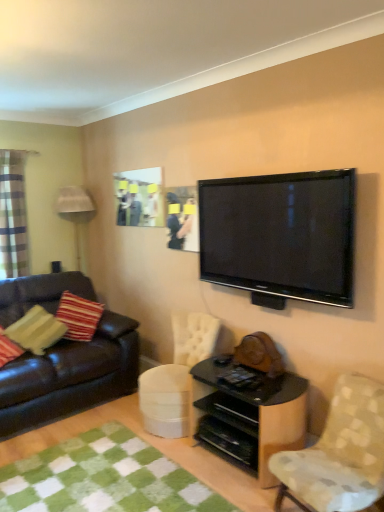
Question: Can you confirm if patterned fabric chair at lower right is positioned to the left of plaid fabric curtain at left?

Choices:
 (A) yes
 (B) no

Answer: (B)

Question: Considering the relative sizes of patterned fabric chair at lower right and plaid fabric curtain at left in the image provided, is patterned fabric chair at lower right shorter than plaid fabric curtain at left?

Choices:
 (A) no
 (B) yes

Answer: (B)

Question: Is patterned fabric chair at lower right beside plaid fabric curtain at left?

Choices:
 (A) no
 (B) yes

Answer: (A)

Question: Is patterned fabric chair at lower right far away from plaid fabric curtain at left?

Choices:
 (A) yes
 (B) no

Answer: (A)

Question: Considering the relative sizes of patterned fabric chair at lower right and plaid fabric curtain at left in the image provided, is patterned fabric chair at lower right bigger than plaid fabric curtain at left?

Choices:
 (A) no
 (B) yes

Answer: (B)

Question: Is point (233, 392) positioned closer to the camera than point (56, 336)?

Choices:
 (A) closer
 (B) farther

Answer: (A)

Question: Considering the positions of black glossy shelf at lower center and striped fabric pillow at left in the image, is black glossy shelf at lower center bigger or smaller than striped fabric pillow at left?

Choices:
 (A) big
 (B) small

Answer: (A)

Question: Is black glossy shelf at lower center taller or shorter than striped fabric pillow at left?

Choices:
 (A) tall
 (B) short

Answer: (A)

Question: Considering their positions, is black glossy shelf at lower center located in front of or behind striped fabric pillow at left?

Choices:
 (A) front
 (B) behind

Answer: (A)

Question: In the image, is leather couch at left on the left side or the right side of patterned fabric chair at lower right?

Choices:
 (A) left
 (B) right

Answer: (A)

Question: Looking at the image, does leather couch at left seem bigger or smaller compared to patterned fabric chair at lower right?

Choices:
 (A) small
 (B) big

Answer: (B)

Question: From a real-world perspective, is leather couch at left positioned above or below patterned fabric chair at lower right?

Choices:
 (A) above
 (B) below

Answer: (A)

Question: Is leather couch at left situated inside patterned fabric chair at lower right or outside?

Choices:
 (A) inside
 (B) outside

Answer: (B)

Question: Is point (278, 438) closer or farther from the camera than point (137, 205)?

Choices:
 (A) farther
 (B) closer

Answer: (B)

Question: From a real-world perspective, relative to matte plastic picture frame at upper center, is black glossy shelf at lower center vertically above or below?

Choices:
 (A) above
 (B) below

Answer: (B)